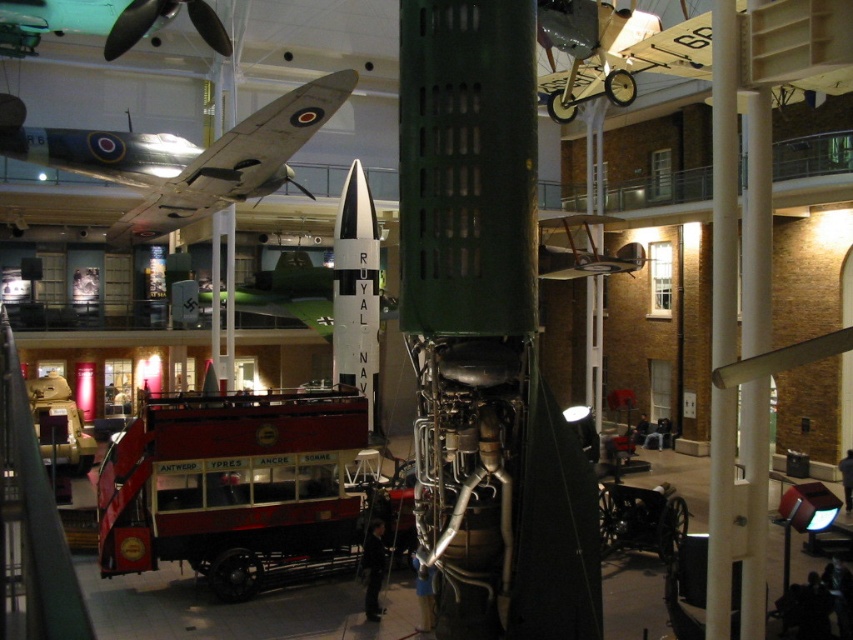
Between white matte royal navy missile at center and brushed metal airplane at upper left, which one is positioned lower?

Positioned lower is white matte royal navy missile at center.

Can you confirm if white matte royal navy missile at center is positioned above brushed metal airplane at upper left?

No, white matte royal navy missile at center is not above brushed metal airplane at upper left.

Who is more forward, (x=335, y=260) or (x=65, y=10)?

Point (x=65, y=10)

At what (x,y) coordinates should I click in order to perform the action: click on white matte royal navy missile at center. Please return your answer as a coordinate pair (x, y). The image size is (853, 640). Looking at the image, I should click on (357, 291).

Who is taller, red polished wood decker bus at center or brushed metal airplane at upper left?

brushed metal airplane at upper left

Is red polished wood decker bus at center shorter than brushed metal airplane at upper left?

Indeed, red polished wood decker bus at center has a lesser height compared to brushed metal airplane at upper left.

Does point (97, 557) come closer to viewer compared to point (62, 1)?

No, (97, 557) is further to viewer.

Identify the location of red polished wood decker bus at center. pos(231,484).

Looking at this image, does polished silver airplane at upper left appear on the right side of light beige wood airplane at upper center?

Incorrect, polished silver airplane at upper left is not on the right side of light beige wood airplane at upper center.

Is point (314, 88) positioned before point (798, 81)?

No, (314, 88) is behind (798, 81).

Where is `polished silver airplane at upper left`? The height and width of the screenshot is (640, 853). polished silver airplane at upper left is located at coordinates (189, 157).